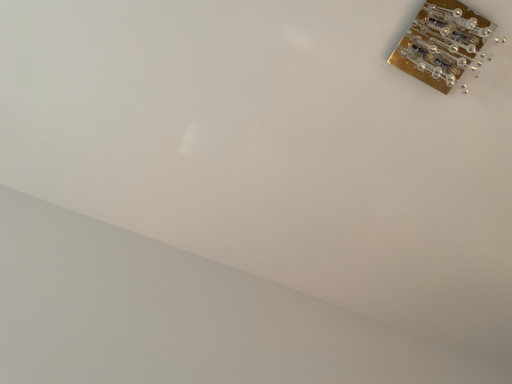
The height and width of the screenshot is (384, 512). In order to click on gold metallic switch at upper right in this screenshot , I will do point(444,44).

What do you see at coordinates (444, 44) in the screenshot?
I see `gold metallic switch at upper right` at bounding box center [444, 44].

Find the location of `gold metallic switch at upper right`. gold metallic switch at upper right is located at coordinates (444, 44).